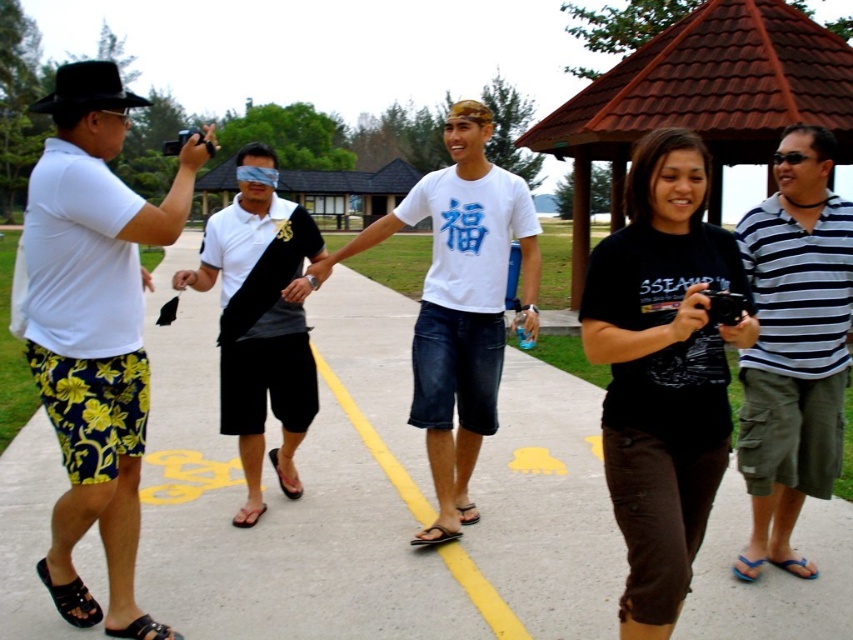
Question: Estimate the real-world distances between objects in this image. Which object is closer to the black matte shorts at center?

Choices:
 (A) white matte t-shirt at center
 (B) brown tiled gazebo at upper center
 (C) striped cotton shirt at right

Answer: (A)

Question: Is floral print shorts at left below white matte t-shirt at center?

Choices:
 (A) yes
 (B) no

Answer: (A)

Question: Is floral print shorts at left smaller than black matte shorts at center?

Choices:
 (A) no
 (B) yes

Answer: (A)

Question: Among these points, which one is nearest to the camera?

Choices:
 (A) (595, 426)
 (B) (302, 285)
 (C) (770, 516)
 (D) (703, 131)

Answer: (C)

Question: Is floral print shorts at left below brown tiled gazebo at upper center?

Choices:
 (A) no
 (B) yes

Answer: (B)

Question: Which object is the farthest from the brown tiled gazebo at upper center?

Choices:
 (A) white matte t-shirt at center
 (B) striped cotton shirt at right
 (C) floral print shorts at left

Answer: (C)